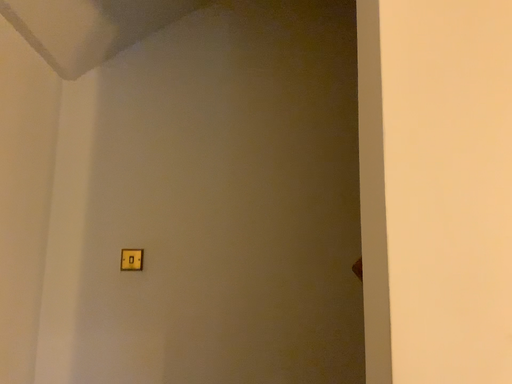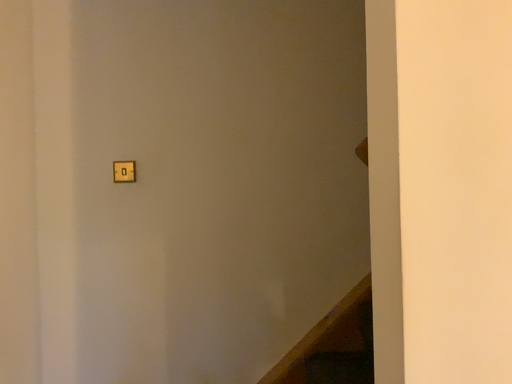
Question: How did the camera likely rotate when shooting the video?

Choices:
 (A) rotated downward
 (B) rotated upward

Answer: (A)